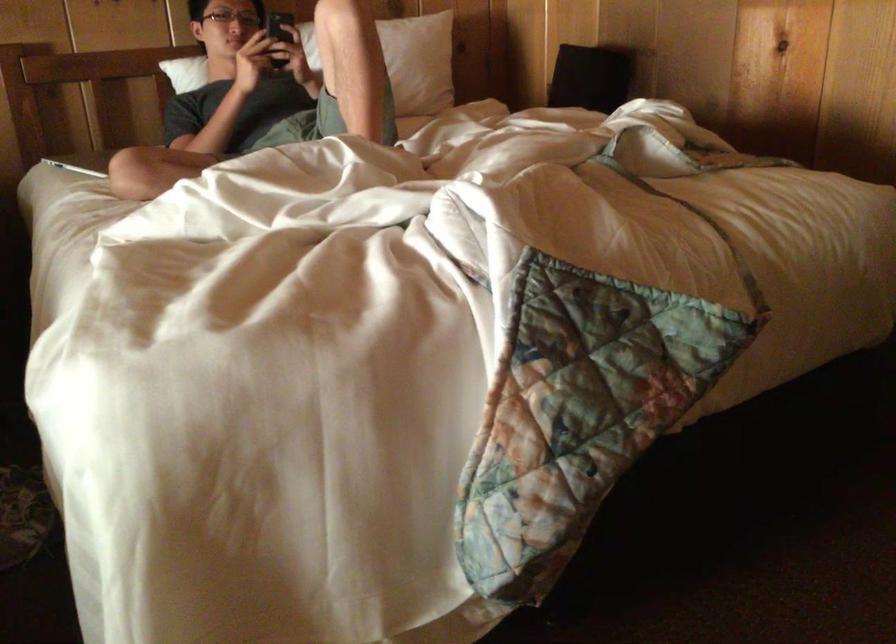
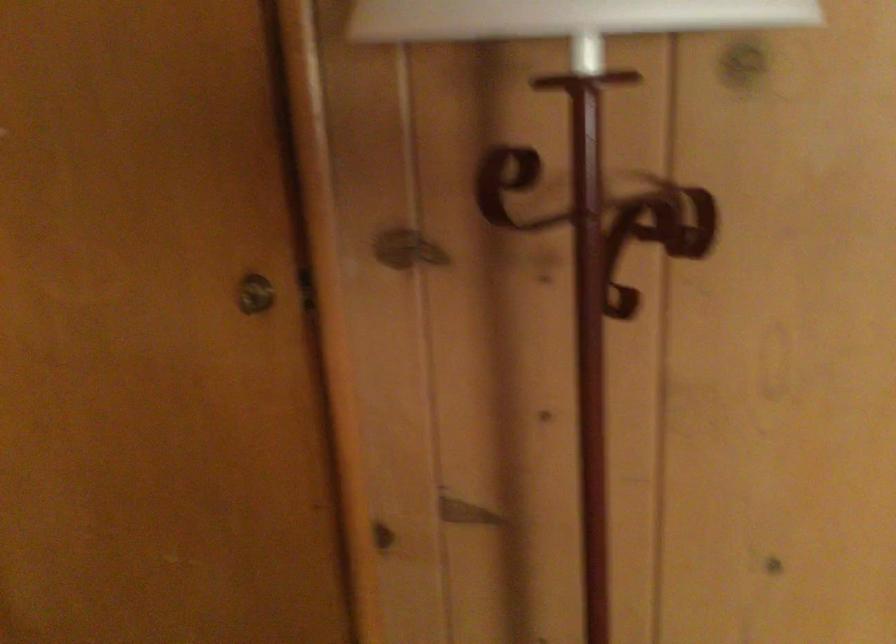
How did the camera likely rotate?

The camera's rotation is toward right-down.